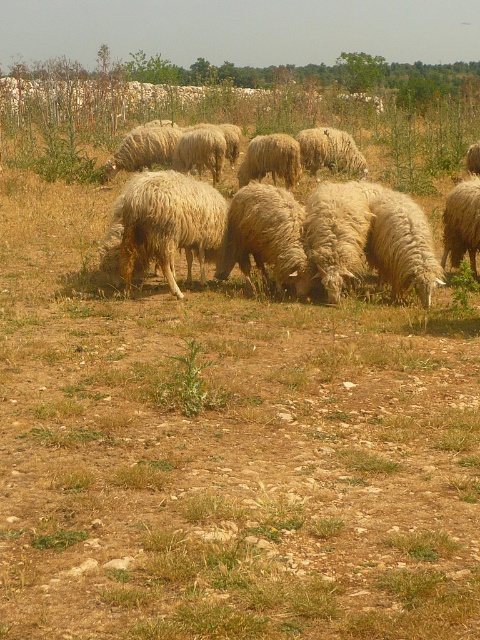
You are a farmer who wants to separate two groups of sheep using a fence. You have a 10 meter long fence. The two groups are the white woolly sheep at center and the fuzzy white sheep at center. Can you place the fence between them to separate the two groups?

The white woolly sheep at center and fuzzy white sheep at center are 8.38 meters apart. Since the fence is 10 meters long, it is long enough to place between them, so yes, you can separate the two groups with the fence.